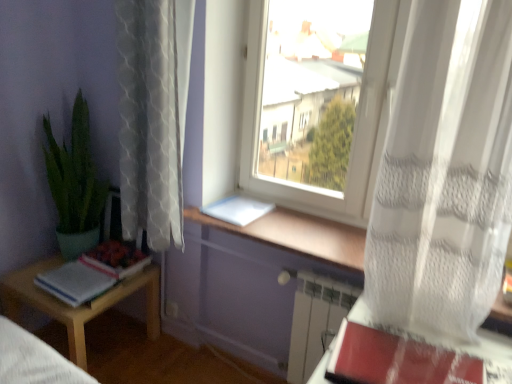
Question: From the image's perspective, is green matte plant at left located above or below white sheer curtain at right, which is the 1th curtain from right to left?

Choices:
 (A) above
 (B) below

Answer: (A)

Question: In the image, is green matte plant at left on the left side or the right side of white sheer curtain at right, which is the 1th curtain from right to left?

Choices:
 (A) right
 (B) left

Answer: (B)

Question: Which object is positioned closest to the wooden bed frame at lower left?

Choices:
 (A) light wood table at lower left
 (B) red matte paperback book at lower right, which is the 1th paperback book from bottom to top
 (C) white lace curtain at left, placed as the 1th curtain when sorted from left to right
 (D) green matte plant at left
 (E) white paper at window, the 1th paperback book viewed from the top

Answer: (A)

Question: Based on their relative distances, which object is nearer to the red matte paperback book at lower right, placed as the second paperback book when sorted from left to right?

Choices:
 (A) white plastic window at center
 (B) white paper book at lower left
 (C) light wood table at lower left
 (D) wooden bed frame at lower left
 (E) white paper at window, placed as the second paperback book when sorted from bottom to top

Answer: (E)